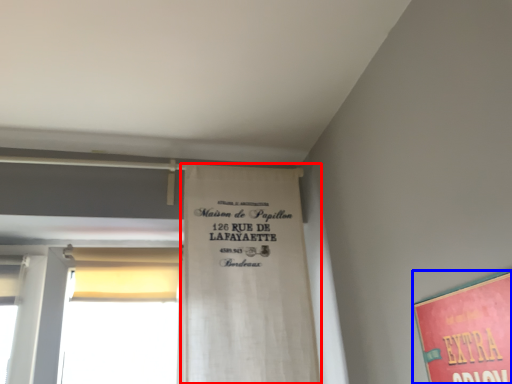
Question: Which of the following is the farthest to the observer, bulletin board (highlighted by a red box) or poster (highlighted by a blue box)?

Choices:
 (A) bulletin board
 (B) poster

Answer: (A)